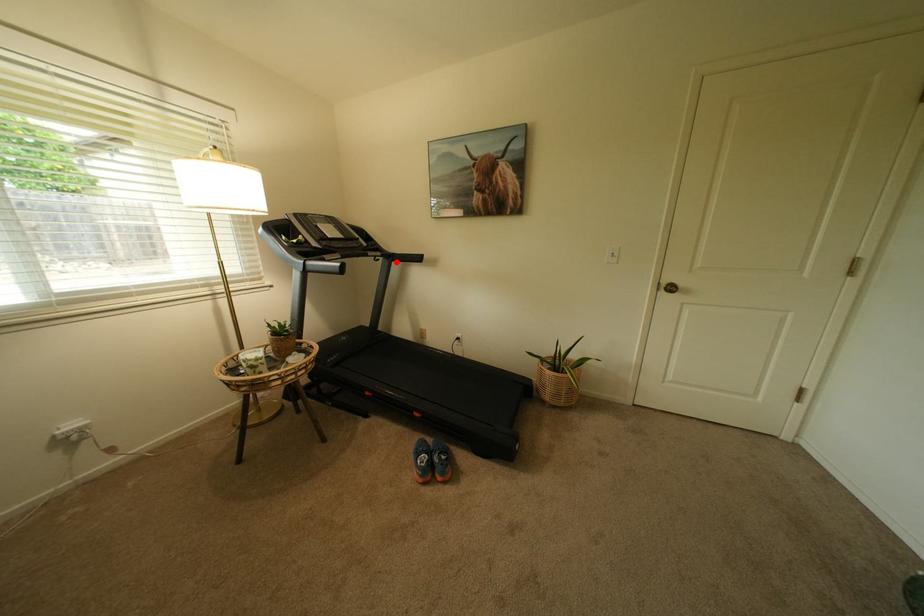
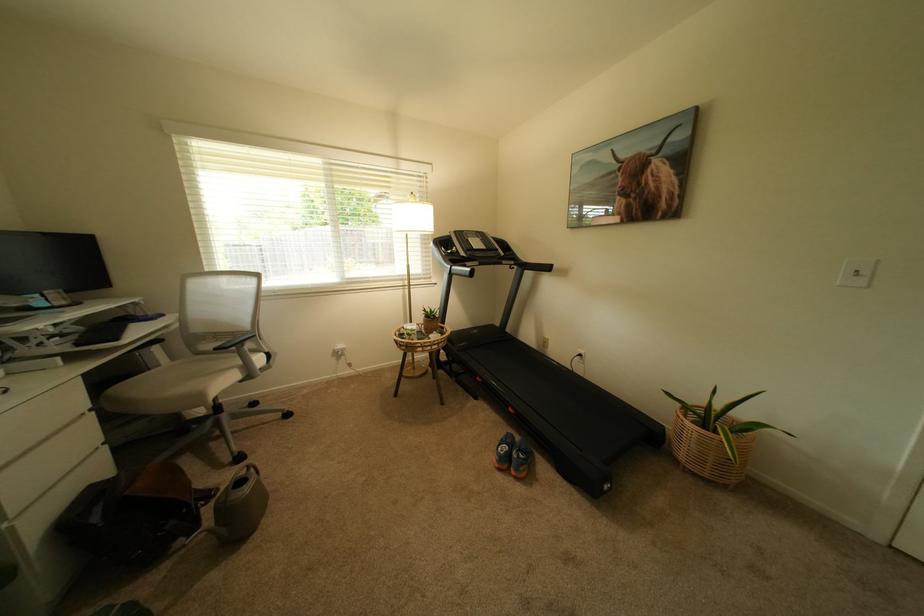
Find the pixel in the second image that matches the highlighted location in the first image.

(529, 270)